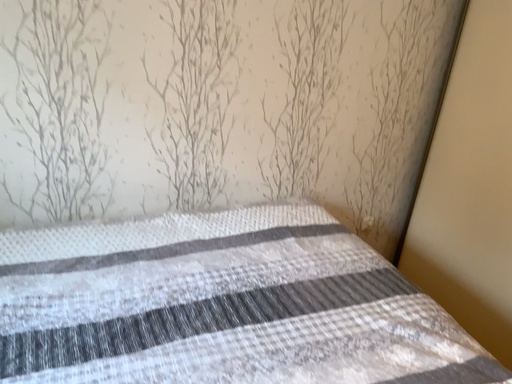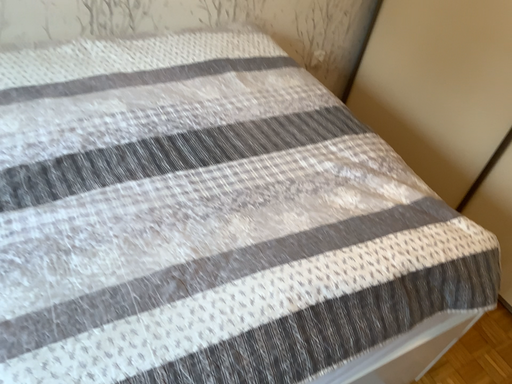
Question: How did the camera likely rotate when shooting the video?

Choices:
 (A) rotated upward
 (B) rotated downward

Answer: (B)